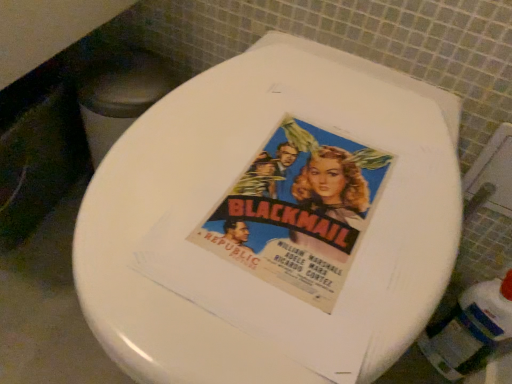
Question: From a real-world perspective, relative to white plastic bottle at lower right, is white glossy toilet seat at center vertically above or below?

Choices:
 (A) below
 (B) above

Answer: (B)

Question: Would you say white glossy toilet seat at center is inside or outside white plastic bottle at lower right?

Choices:
 (A) outside
 (B) inside

Answer: (A)

Question: Is point (105, 256) positioned closer to the camera than point (437, 334)?

Choices:
 (A) farther
 (B) closer

Answer: (B)

Question: From the image's perspective, relative to white glossy toilet seat at center, is white plastic bottle at lower right above or below?

Choices:
 (A) above
 (B) below

Answer: (B)

Question: Visually, is white plastic bottle at lower right positioned to the left or to the right of white glossy toilet seat at center?

Choices:
 (A) left
 (B) right

Answer: (B)

Question: Is white plastic bottle at lower right taller or shorter than white glossy toilet seat at center?

Choices:
 (A) short
 (B) tall

Answer: (A)

Question: Is white plastic bottle at lower right bigger or smaller than white glossy toilet seat at center?

Choices:
 (A) small
 (B) big

Answer: (A)